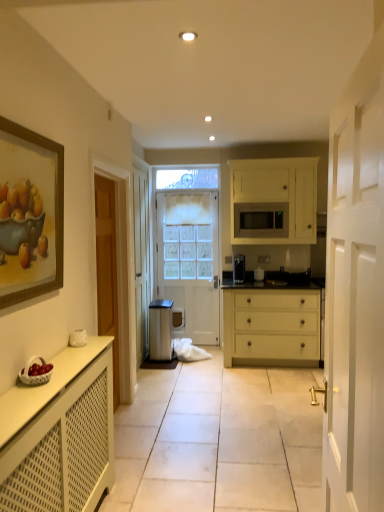
The width and height of the screenshot is (384, 512). I want to click on empty space that is ontop of white glossy radiator at lower left (from a real-world perspective), so click(223, 402).